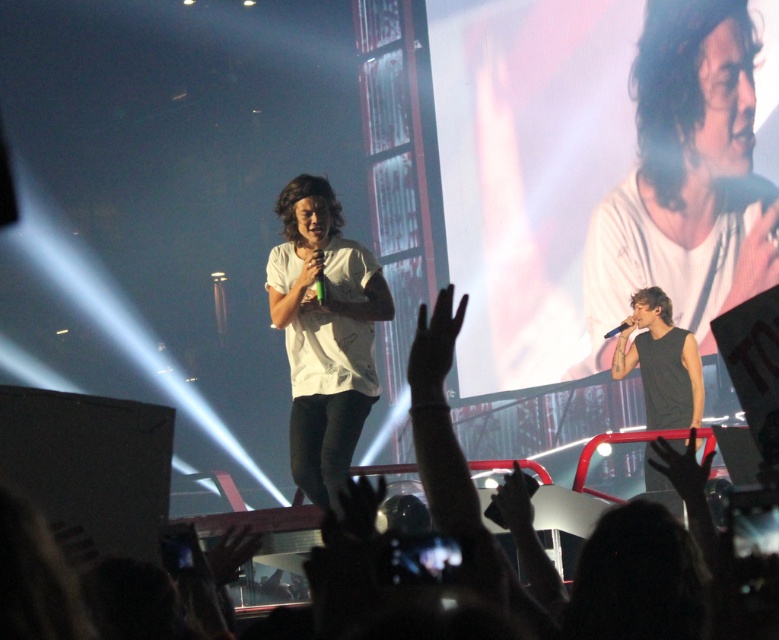
Between white matte shirt at upper right and matte white microphone at center, which one has less height?

Standing shorter between the two is matte white microphone at center.

Can you confirm if white matte shirt at upper right is smaller than matte white microphone at center?

Actually, white matte shirt at upper right might be larger than matte white microphone at center.

Between point (774, 264) and point (323, 298), which one is positioned in front?

Point (323, 298)

This screenshot has height=640, width=779. Find the location of `white matte shirt at upper right`. white matte shirt at upper right is located at coordinates (686, 177).

Which of these two, black matte hand at center or transparent plastic glove at lower right, stands shorter?

transparent plastic glove at lower right

Between point (450, 337) and point (658, 470), which one is positioned in front?

Point (658, 470) is more forward.

Who is more distant from viewer, (x=457, y=310) or (x=668, y=465)?

Positioned behind is point (x=668, y=465).

Where is `black matte hand at center`? Image resolution: width=779 pixels, height=640 pixels. black matte hand at center is located at coordinates (434, 346).

Does black sleeveless shirt at right lie behind black matte hand at center?

Yes, black sleeveless shirt at right is further from the viewer.

Does black sleeveless shirt at right appear over black matte hand at center?

No, black sleeveless shirt at right is not above black matte hand at center.

Does point (681, 348) lie in front of point (439, 344)?

No.

Find the location of `black sleeveless shirt at right`. black sleeveless shirt at right is located at coordinates (661, 362).